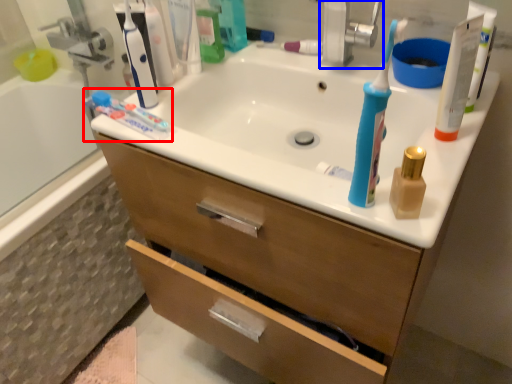
Question: Which object appears farthest to the camera in this image, toothpaste (highlighted by a red box) or faucet (highlighted by a blue box)?

Choices:
 (A) toothpaste
 (B) faucet

Answer: (B)